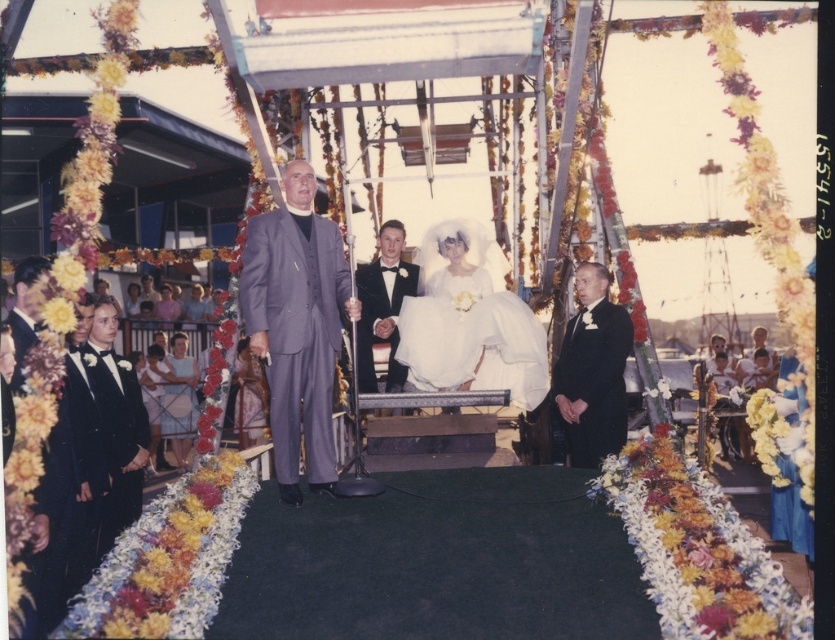
You are a photographer positioned at the back of the stage. You need to capture a clear photo of both the matte gray suit at center and the black satin suit at right. Which person will appear larger in the photo?

The matte gray suit at center will appear larger in the photo because it is closer to the photographer than the black satin suit at right.

You are a photographer positioned at the camera. The wedding couple is standing 6.89 meters away from you, wearing a black satin suit at right. To capture a closeup shot of the couple, you need them to be within 5 meters. Should you ask them to move closer or should you move closer yourself?

The black satin suit at right is 6.89 meters away from the camera. Since the required distance for a closeup is 5 meters, you should move closer to the couple by 1.89 meters to achieve the desired shot.

You are a photographer at the wedding ceremony. You need to capture a photo where both the matte gray suit at center and the white satin dress at center are clearly visible. Based on their positions, which one should you focus on first to ensure both are in frame?

The matte gray suit at center is positioned under the white satin dress at center, so focusing on the white satin dress at center first will ensure both are in frame.